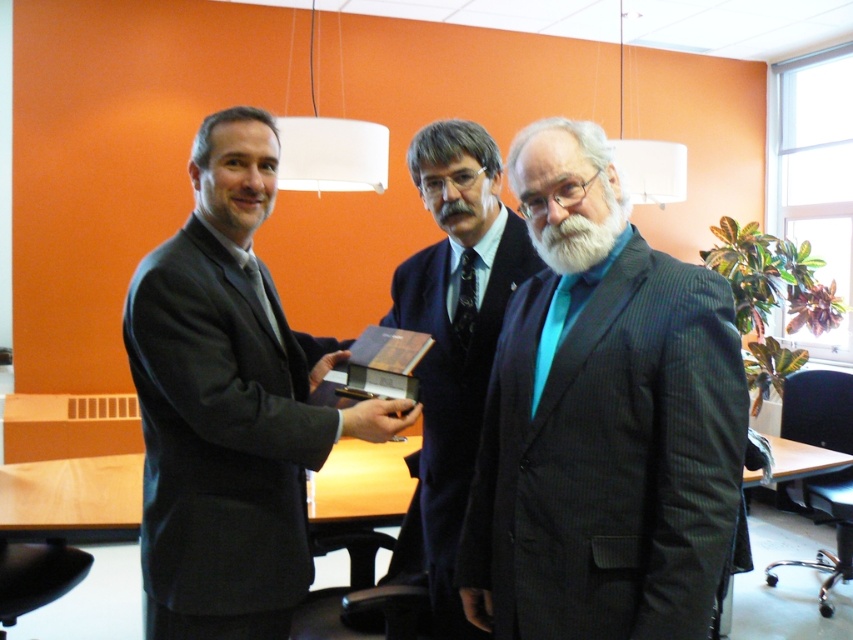
What do you see at coordinates (602, 420) in the screenshot? I see `dark gray pinstripe suit at center` at bounding box center [602, 420].

Where is `dark gray pinstripe suit at center`? The height and width of the screenshot is (640, 853). dark gray pinstripe suit at center is located at coordinates (602, 420).

Who is more forward, (563,381) or (155,563)?

Positioned in front is point (563,381).

Where is `dark gray pinstripe suit at center`? dark gray pinstripe suit at center is located at coordinates (602, 420).

The height and width of the screenshot is (640, 853). Describe the element at coordinates (602, 420) in the screenshot. I see `dark gray pinstripe suit at center` at that location.

Is point (589, 602) positioned in front of point (442, 243)?

That is True.

Find the location of `dark gray pinstripe suit at center`. dark gray pinstripe suit at center is located at coordinates (602, 420).

Can you confirm if matte black suit at left is smaller than dark blue suit at center?

Actually, matte black suit at left might be larger than dark blue suit at center.

Where is `matte black suit at left`? Image resolution: width=853 pixels, height=640 pixels. matte black suit at left is located at coordinates (229, 404).

Identify the location of matte black suit at left. (229, 404).